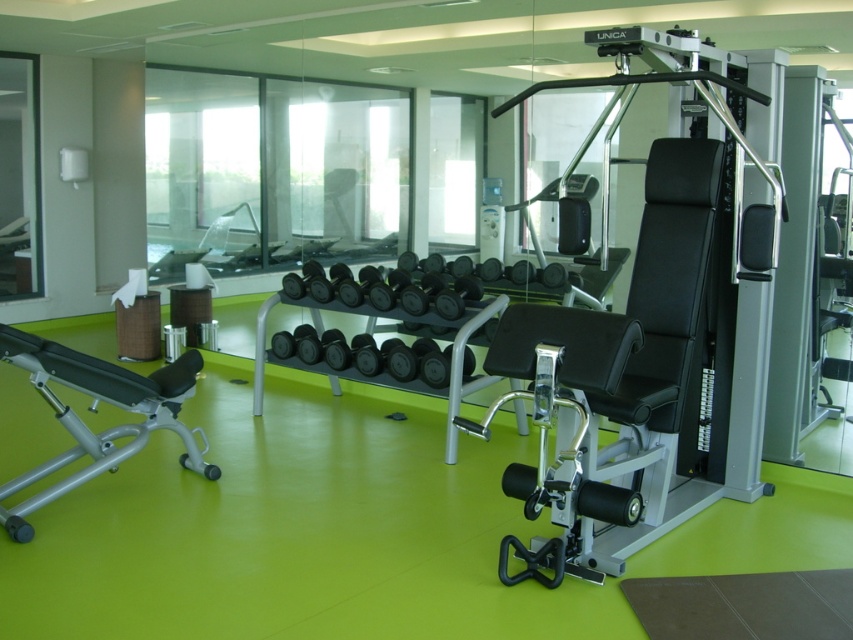
Question: In this image, where is matte black bench at left located relative to black rubber dumbbell at center?

Choices:
 (A) above
 (B) below

Answer: (A)

Question: Among these objects, which one is farthest from the camera?

Choices:
 (A) matte black bench at left
 (B) black rubber dumbbells at center
 (C) black rubber dumbbell at center

Answer: (B)

Question: Which of the following is the closest to the observer?

Choices:
 (A) matte black bench at left
 (B) black rubber dumbbell at center

Answer: (B)

Question: Is matte black bench at left positioned behind black rubber dumbbell at center?

Choices:
 (A) yes
 (B) no

Answer: (A)

Question: Does matte black bench at left appear on the right side of black rubber dumbbell at center?

Choices:
 (A) yes
 (B) no

Answer: (B)

Question: Based on their relative distances, which object is nearer to the black rubber dumbbells at center?

Choices:
 (A) black rubber dumbbell at center
 (B) matte black bench at left

Answer: (B)